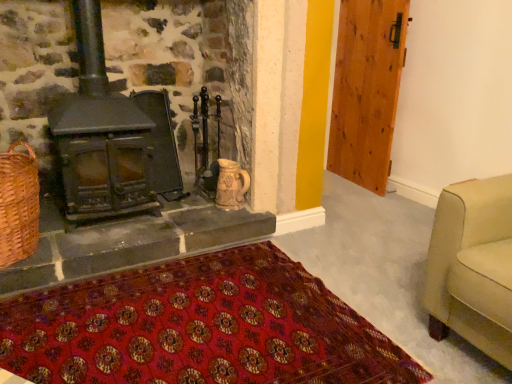
Question: Can you confirm if wooden door at right is shorter than matte black wood burning stove at left?

Choices:
 (A) yes
 (B) no

Answer: (B)

Question: Is wooden door at right smaller than matte black wood burning stove at left?

Choices:
 (A) no
 (B) yes

Answer: (B)

Question: Can you see wooden door at right touching matte black wood burning stove at left?

Choices:
 (A) yes
 (B) no

Answer: (B)

Question: Does wooden door at right have a greater width compared to matte black wood burning stove at left?

Choices:
 (A) yes
 (B) no

Answer: (B)

Question: Does wooden door at right have a greater height compared to matte black wood burning stove at left?

Choices:
 (A) yes
 (B) no

Answer: (A)

Question: From the image's perspective, is wooden door at right beneath matte black wood burning stove at left?

Choices:
 (A) no
 (B) yes

Answer: (A)

Question: From the image's perspective, is woven brown basket at lower left below wooden door at right?

Choices:
 (A) no
 (B) yes

Answer: (B)

Question: Considering the relative positions of woven brown basket at lower left and wooden door at right in the image provided, is woven brown basket at lower left to the left of wooden door at right from the viewer's perspective?

Choices:
 (A) no
 (B) yes

Answer: (B)

Question: From a real-world perspective, is woven brown basket at lower left positioned over wooden door at right based on gravity?

Choices:
 (A) no
 (B) yes

Answer: (A)

Question: Is wooden door at right surrounded by woven brown basket at lower left?

Choices:
 (A) yes
 (B) no

Answer: (B)

Question: Is woven brown basket at lower left wider than wooden door at right?

Choices:
 (A) yes
 (B) no

Answer: (A)

Question: Is woven brown basket at lower left in front of wooden door at right?

Choices:
 (A) no
 (B) yes

Answer: (B)

Question: Is woven brown basket at lower left located outside red woven mat at lower center?

Choices:
 (A) yes
 (B) no

Answer: (A)